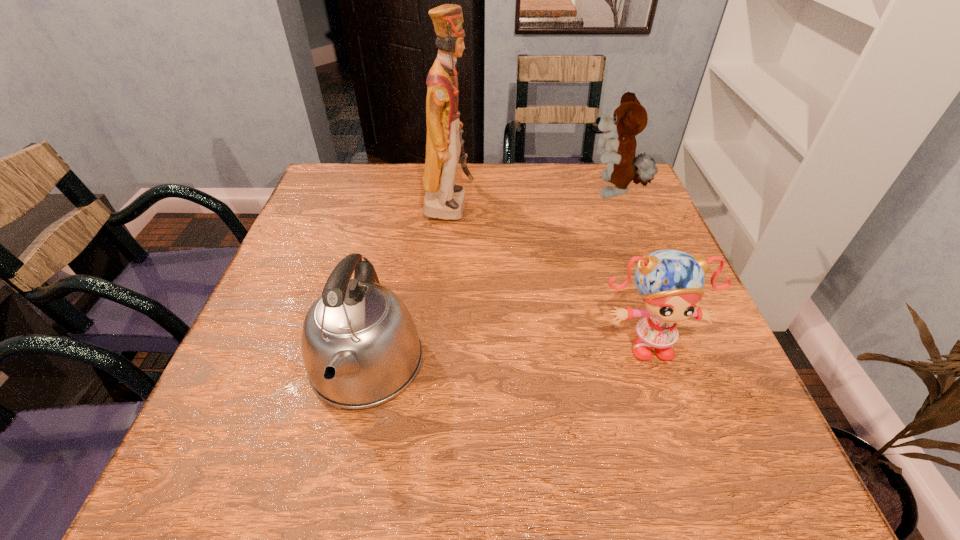
At what (x,y) coordinates should I click in order to perform the action: click on nutcracker located in the far edge section of the desktop. Please return your answer as a coordinate pair (x, y). This screenshot has height=540, width=960. Looking at the image, I should click on (444, 199).

What are the coordinates of `puppy that is at the far edge` in the screenshot? It's located at (629, 118).

Identify the location of object present at the left edge. The image size is (960, 540). (360, 346).

Locate an element on the screen. Image resolution: width=960 pixels, height=540 pixels. puppy situated at the right edge is located at coordinates (629, 118).

Where is `doll present at the right edge`? The width and height of the screenshot is (960, 540). doll present at the right edge is located at coordinates click(x=670, y=281).

In order to click on object that is positioned at the far right corner in this screenshot , I will do `click(629, 118)`.

The height and width of the screenshot is (540, 960). In the image, there is a desktop. Identify the location of vacant space at the far edge. (388, 198).

I want to click on vacant space at the near edge of the desktop, so click(416, 482).

In order to click on vacant region at the left edge of the desktop in this screenshot , I will do `click(289, 241)`.

The width and height of the screenshot is (960, 540). In the image, there is a desktop. Find the location of `vacant space at the right edge`. vacant space at the right edge is located at coordinates (621, 214).